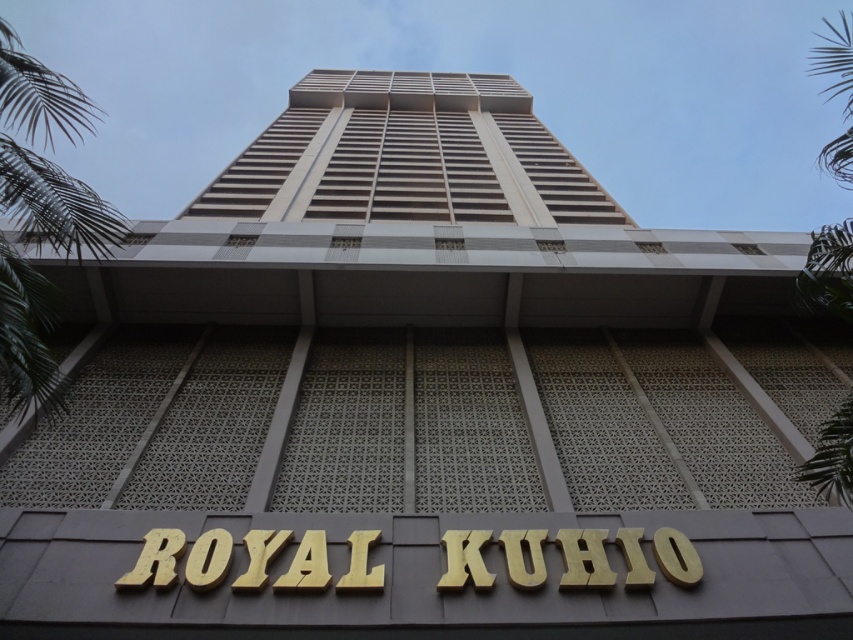
Who is higher up, beige concrete building at center or green leafy palm tree at right?

beige concrete building at center is higher up.

You are a GUI agent. You are given a task and a screenshot of the screen. Output one action in this format:
    pyautogui.click(x=<x>, y=<y>)
    Task: Click on the beige concrete building at center
    The image size is (853, 640).
    Given the screenshot: What is the action you would take?
    pyautogui.click(x=408, y=156)

In the scene shown: Who is more forward, (401, 109) or (816, 61)?

Point (816, 61)

The width and height of the screenshot is (853, 640). I want to click on beige concrete building at center, so click(x=408, y=156).

Does beige concrete building at center have a greater height compared to green leafy palm tree at left?

Yes, beige concrete building at center is taller than green leafy palm tree at left.

Who is higher up, beige concrete building at center or green leafy palm tree at left?

Positioned higher is beige concrete building at center.

Between point (564, 164) and point (4, 355), which one is positioned behind?

The point (564, 164) is more distant.

The height and width of the screenshot is (640, 853). What are the coordinates of `beige concrete building at center` in the screenshot? It's located at (408, 156).

Does point (42, 305) come closer to viewer compared to point (822, 449)?

Yes, point (42, 305) is in front of point (822, 449).

Can you confirm if green leafy palm tree at left is bigger than green leafy palm tree at right?

No, green leafy palm tree at left is not bigger than green leafy palm tree at right.

Which is behind, point (44, 200) or point (833, 248)?

The point (833, 248) is more distant.

Find the location of a particular element. The width and height of the screenshot is (853, 640). green leafy palm tree at left is located at coordinates pyautogui.click(x=45, y=157).